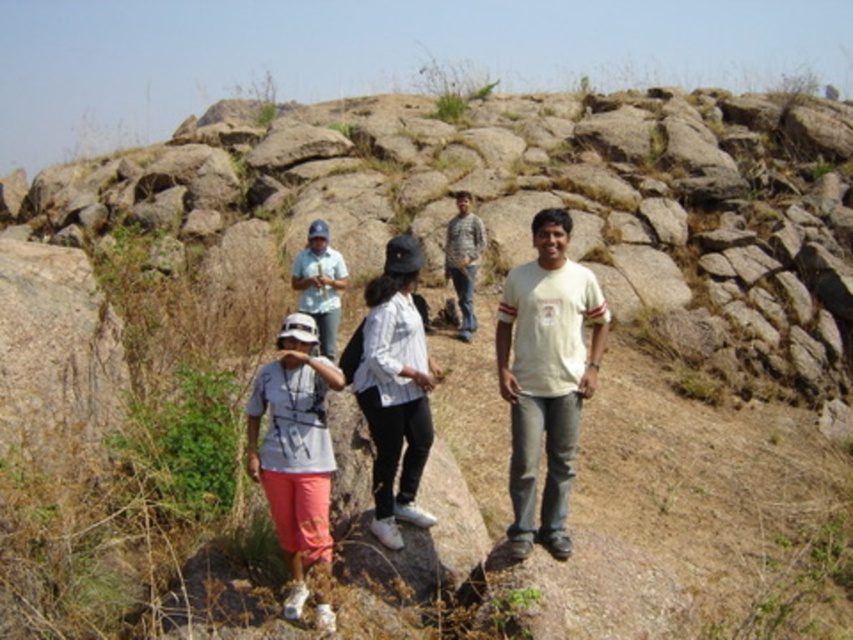
In the scene shown: You are standing on a rocky outcrop in a dry landscape with five people. You notice two points marked as point 1 at coordinates (558, 385) and point 2 at (473, 266). Which point is closer to you?

Point 1 at coordinates (558, 385) is closer to the viewer than point 2 at (473, 266).

You are standing at the point labeled point (x=521, y=483) and want to walk to the point labeled point (x=412, y=372). Given that the path between them is rocky and uneven, will you have to walk uphill or downhill?

Since point (x=521, y=483) is closer to the viewer than point (x=412, y=372), you will have to walk uphill to reach the latter point.